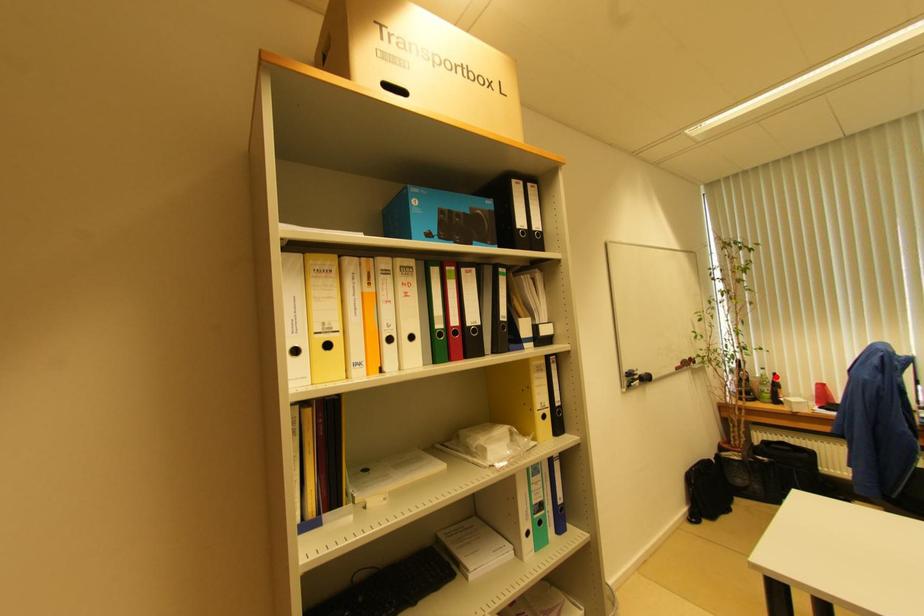
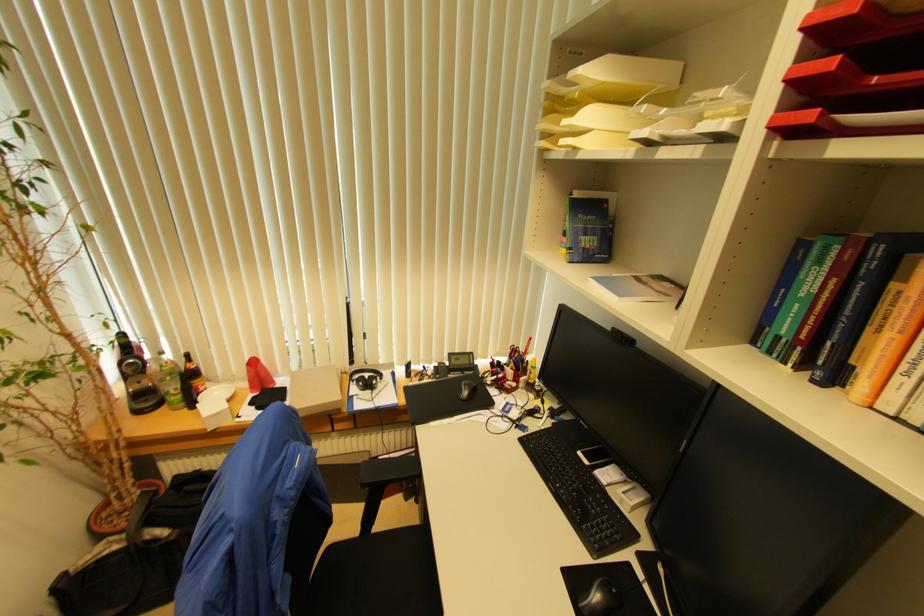
Find the pixel in the second image that matches the highlighted location in the first image.

(188, 358)